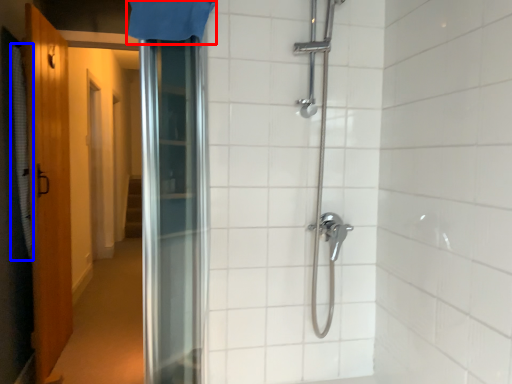
Question: Which of the following is the farthest to the observer, shower curtain (highlighted by a red box) or shower curtain (highlighted by a blue box)?

Choices:
 (A) shower curtain
 (B) shower curtain

Answer: (B)